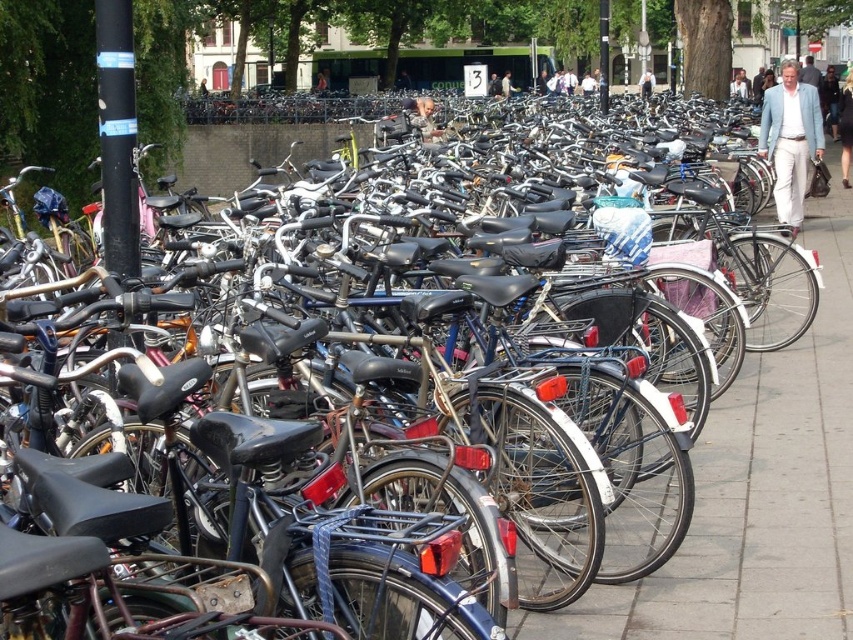
Question: Is smooth concrete pavement at center to the right of light blue fabric jacket at center from the viewer's perspective?

Choices:
 (A) no
 (B) yes

Answer: (A)

Question: Can you confirm if smooth concrete pavement at center is bigger than light blue fabric jacket at center?

Choices:
 (A) yes
 (B) no

Answer: (A)

Question: Is smooth concrete pavement at center below light blue fabric jacket at center?

Choices:
 (A) no
 (B) yes

Answer: (B)